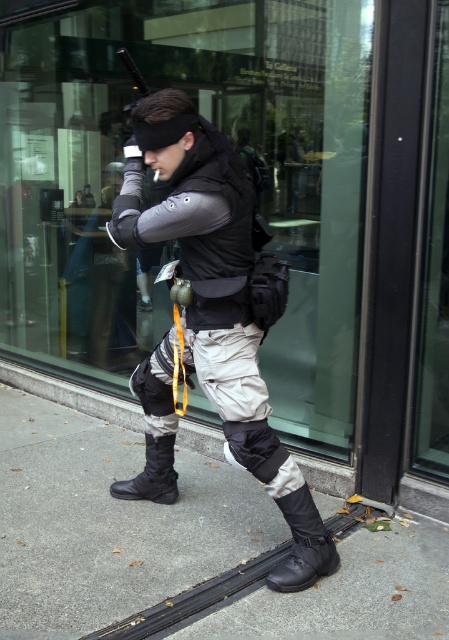
You are a security guard standing 10 feet away from the glass storefront. You notice the matte black vest at center. Can you clearly see the details of the vest from your current position?

The matte black vest at center and viewer are 7.53 feet apart. Since you are standing 10 feet away from the glass storefront, you are farther than the distance to the vest, so you can clearly see the details of the matte black vest at center.

You are a fashion designer analyzing the image. You need to determine which item of clothing is bigger between the matte black vest at center and the black leather boot at lower center. Which one is larger?

The matte black vest at center is larger in size than the black leather boot at lower center.

You are a delivery person trying to place a package on the sidewalk near the transparent glass at center and the black leather boot at lower center. The package requires a flat surface at least 1.5 meters away from any obstacles. Can you place the package between them?

The transparent glass at center is 1.63 meters away from the black leather boot at lower center. Since the required distance is at least 1.5 meters, the package can be placed between them as the distance meets the requirement.